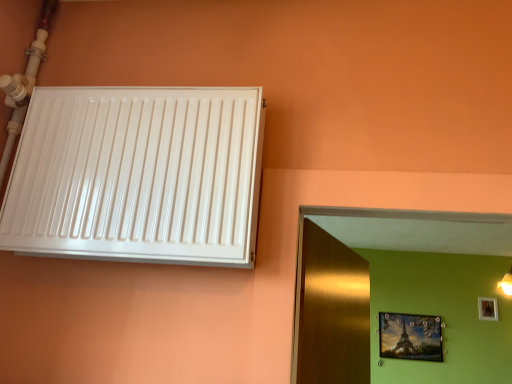
Question: Is white glossy radiator at upper left to the right of wooden photo frame at upper right, positioned as the second picture frame in left-to-right order, from the viewer's perspective?

Choices:
 (A) no
 (B) yes

Answer: (A)

Question: Considering the relative sizes of white glossy radiator at upper left and wooden photo frame at upper right, positioned as the second picture frame in left-to-right order, in the image provided, is white glossy radiator at upper left shorter than wooden photo frame at upper right, positioned as the second picture frame in left-to-right order,?

Choices:
 (A) yes
 (B) no

Answer: (B)

Question: Is white glossy radiator at upper left directly adjacent to wooden photo frame at upper right, the 2th picture frame from the bottom?

Choices:
 (A) no
 (B) yes

Answer: (A)

Question: Could you tell me if white glossy radiator at upper left is turned towards wooden photo frame at upper right, which is the 1th picture frame from right to left?

Choices:
 (A) no
 (B) yes

Answer: (A)

Question: Is wooden photo frame at upper right, which is the 1th picture frame from right to left, at the back of white glossy radiator at upper left?

Choices:
 (A) no
 (B) yes

Answer: (A)

Question: Is white glossy radiator at upper left in front of or behind wooden photo frame at upper right, which is the 1th picture frame from right to left, in the image?

Choices:
 (A) behind
 (B) front

Answer: (B)

Question: Based on their positions, is white glossy radiator at upper left located to the left or right of wooden photo frame at upper right, positioned as the second picture frame in left-to-right order?

Choices:
 (A) right
 (B) left

Answer: (B)

Question: Is white glossy radiator at upper left wider or thinner than wooden photo frame at upper right, the 2th picture frame from the bottom?

Choices:
 (A) thin
 (B) wide

Answer: (B)

Question: Considering the positions of point (228, 175) and point (489, 302), is point (228, 175) closer or farther from the camera than point (489, 302)?

Choices:
 (A) farther
 (B) closer

Answer: (B)

Question: From a real-world perspective, is metallic gold picture frame at upper right, the second picture frame from the top, positioned above or below wooden photo frame at upper right, the 2th picture frame from the bottom?

Choices:
 (A) below
 (B) above

Answer: (A)

Question: From their relative heights in the image, would you say metallic gold picture frame at upper right, the second picture frame positioned from the right, is taller or shorter than wooden photo frame at upper right, placed as the first picture frame when sorted from top to bottom?

Choices:
 (A) tall
 (B) short

Answer: (A)

Question: Would you say metallic gold picture frame at upper right, the second picture frame from the top, is inside or outside wooden photo frame at upper right, which is the 1th picture frame from right to left?

Choices:
 (A) inside
 (B) outside

Answer: (B)

Question: In terms of size, does metallic gold picture frame at upper right, arranged as the first picture frame when ordered from the bottom, appear bigger or smaller than wooden photo frame at upper right, placed as the first picture frame when sorted from top to bottom?

Choices:
 (A) big
 (B) small

Answer: (A)

Question: Considering the positions of point (29, 109) and point (407, 327), is point (29, 109) closer or farther from the camera than point (407, 327)?

Choices:
 (A) closer
 (B) farther

Answer: (A)

Question: From the image's perspective, is white glossy radiator at upper left positioned above or below metallic gold picture frame at upper right, the second picture frame positioned from the right?

Choices:
 (A) below
 (B) above

Answer: (B)